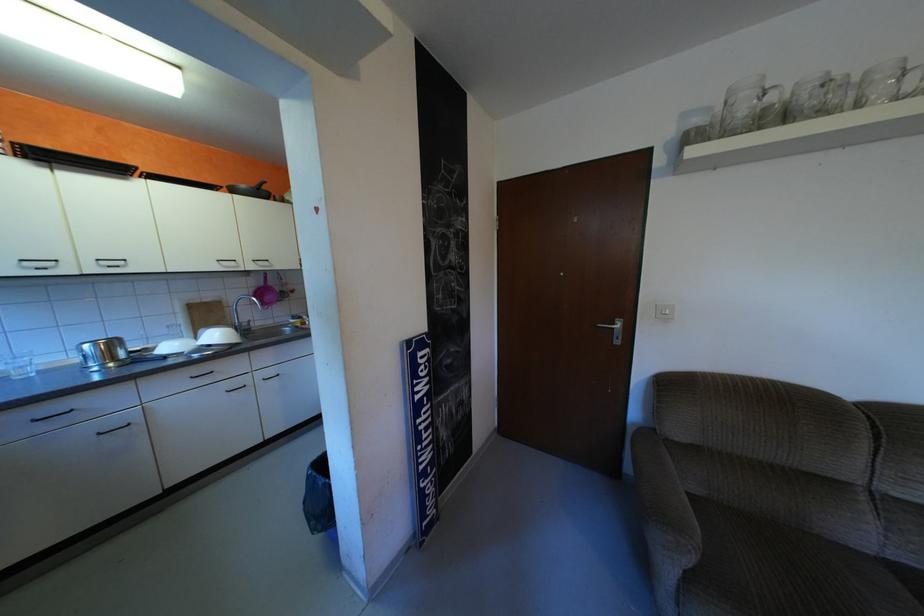
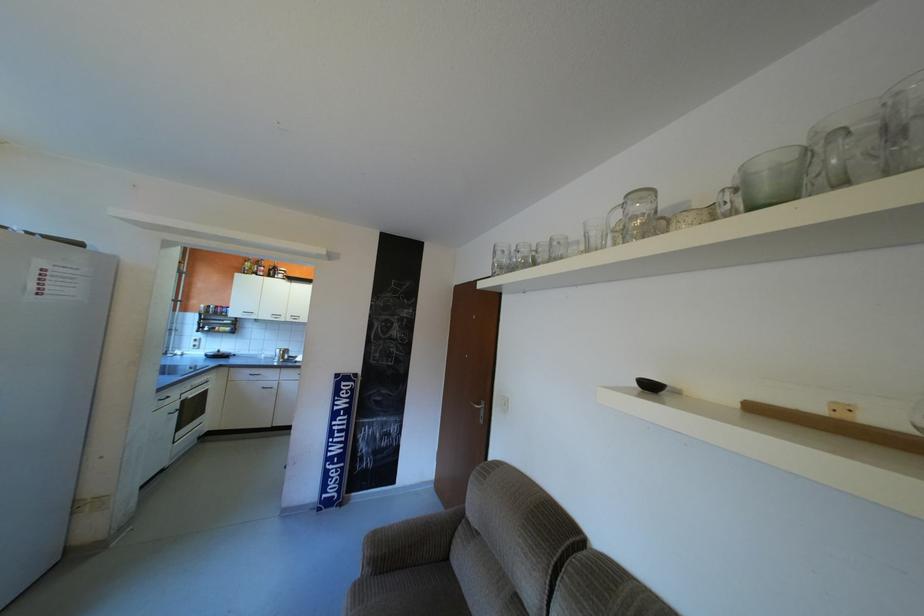
The point at (432, 427) is marked in the first image. Where is the corresponding point in the second image?

(346, 427)